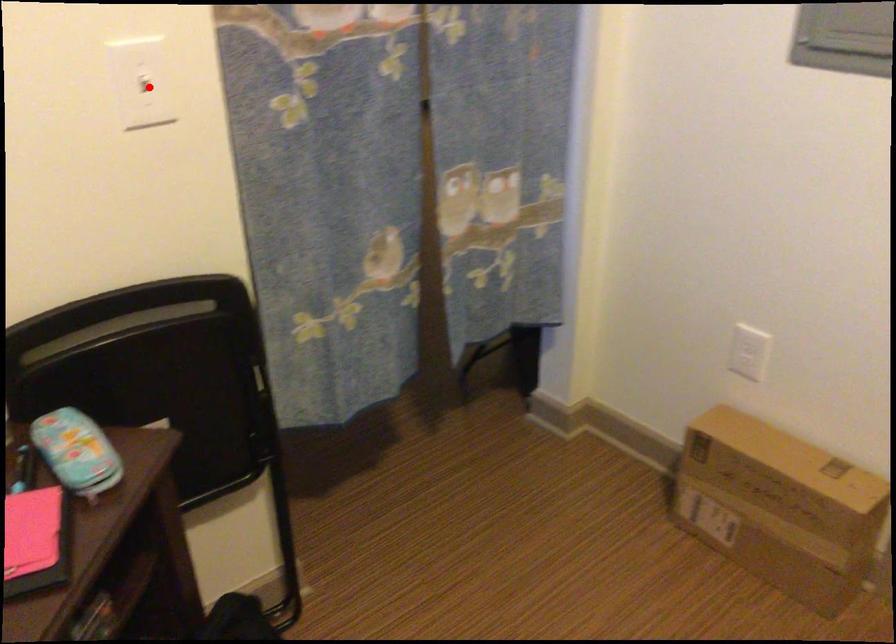
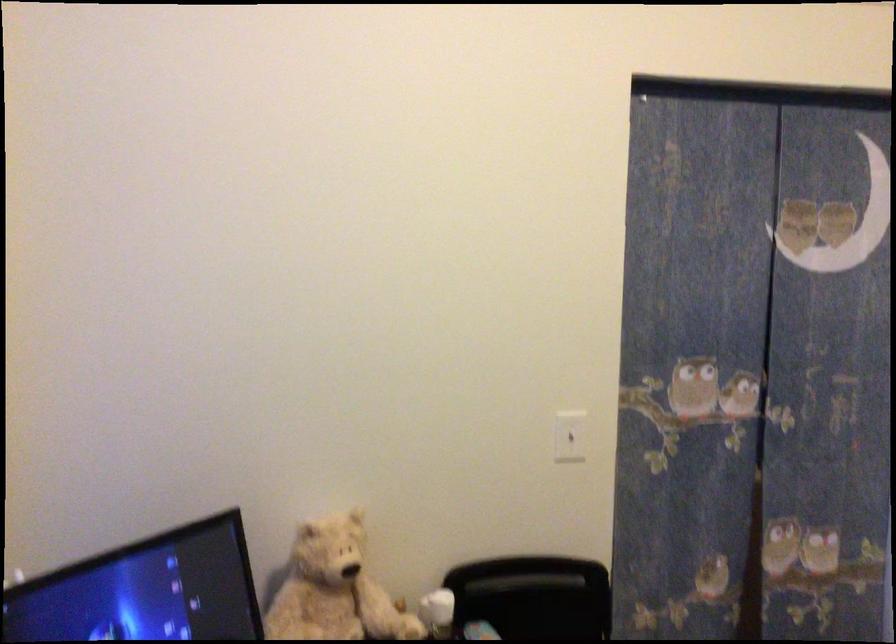
Question: I am providing you with two images of the same scene from different viewpoints. A red point is shown in image1. For the corresponding object point in image2, is it positioned nearer or farther from the camera?

Choices:
 (A) Nearer
 (B) Farther

Answer: (B)